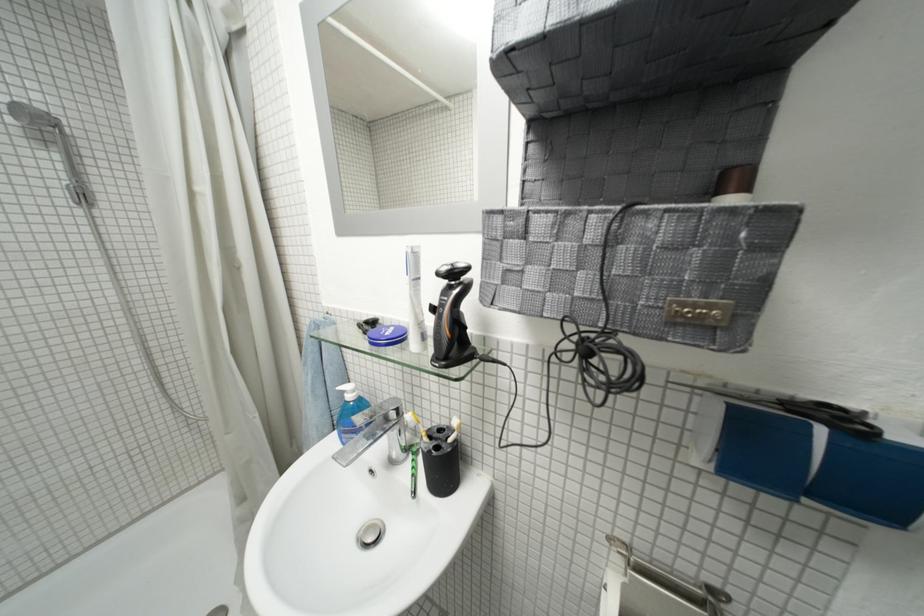
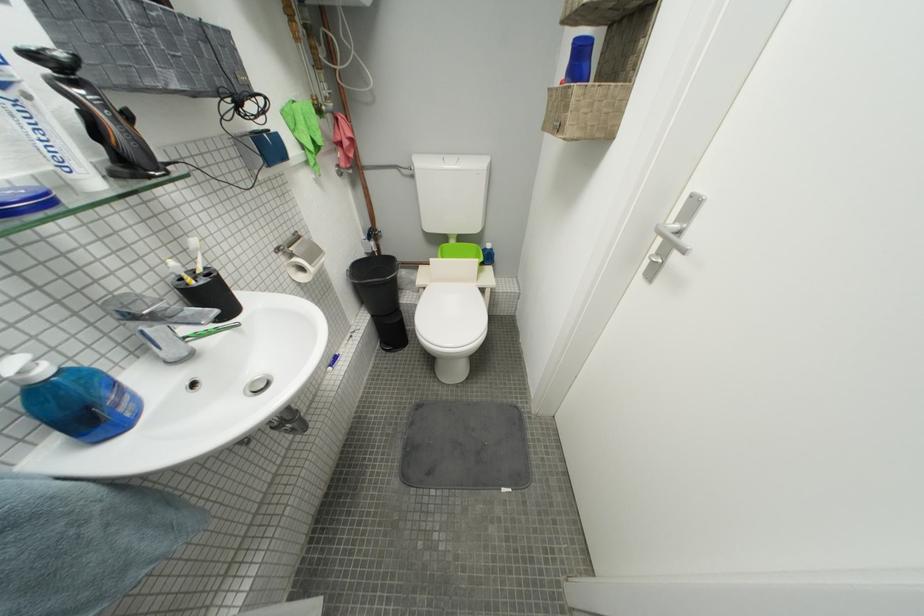
Locate, in the second image, the point that corresponds to (359,399) in the first image.

(53, 374)